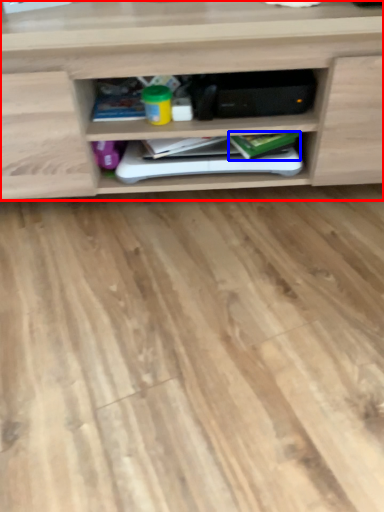
Question: Which object appears farthest to the camera in this image, shelf (highlighted by a red box) or book (highlighted by a blue box)?

Choices:
 (A) shelf
 (B) book

Answer: (B)